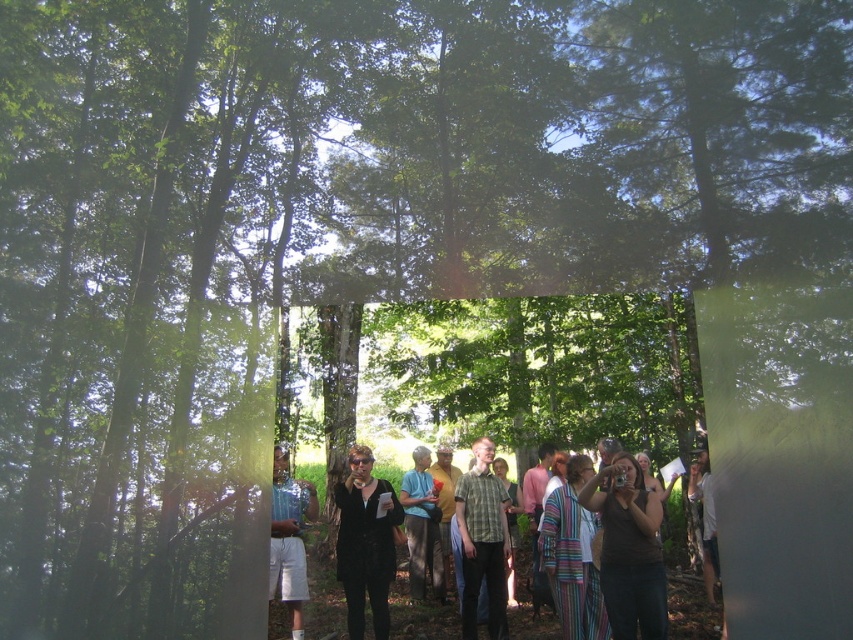
Question: Among these objects, which one is nearest to the camera?

Choices:
 (A) green plaid shirt at center
 (B) black matte blazer at center

Answer: (A)

Question: Can you confirm if matte black camera at center is positioned below light blue shirt at center?

Choices:
 (A) yes
 (B) no

Answer: (A)

Question: Is striped fabric pants at center below light blue shirt at center?

Choices:
 (A) yes
 (B) no

Answer: (A)

Question: Can you confirm if black fabric crowd at center is wider than light blue denim shorts at left?

Choices:
 (A) no
 (B) yes

Answer: (B)

Question: Which of the following is the closest to the observer?

Choices:
 (A) (589, 572)
 (B) (688, 595)
 (C) (467, 474)

Answer: (B)

Question: Which is farther from the matte black camera at center?

Choices:
 (A) light blue denim shorts at left
 (B) light blue shirt at center

Answer: (A)